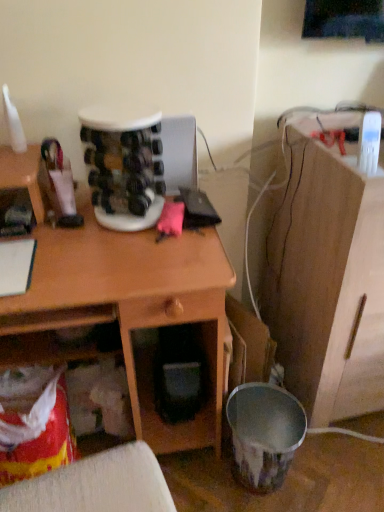
Question: From a real-world perspective, is wooden cabinet at right physically located above or below wooden desk at center?

Choices:
 (A) below
 (B) above

Answer: (B)

Question: Is wooden cabinet at right taller or shorter than wooden desk at center?

Choices:
 (A) short
 (B) tall

Answer: (B)

Question: Is wooden cabinet at right wider or thinner than wooden desk at center?

Choices:
 (A) thin
 (B) wide

Answer: (B)

Question: Looking at their shapes, would you say wooden desk at center is wider or thinner than wooden cabinet at right?

Choices:
 (A) wide
 (B) thin

Answer: (B)

Question: Considering the positions of point (69, 270) and point (365, 390), is point (69, 270) closer or farther from the camera than point (365, 390)?

Choices:
 (A) farther
 (B) closer

Answer: (B)

Question: From their relative heights in the image, would you say wooden desk at center is taller or shorter than wooden cabinet at right?

Choices:
 (A) tall
 (B) short

Answer: (B)

Question: Is wooden desk at center inside or outside of wooden cabinet at right?

Choices:
 (A) inside
 (B) outside

Answer: (B)